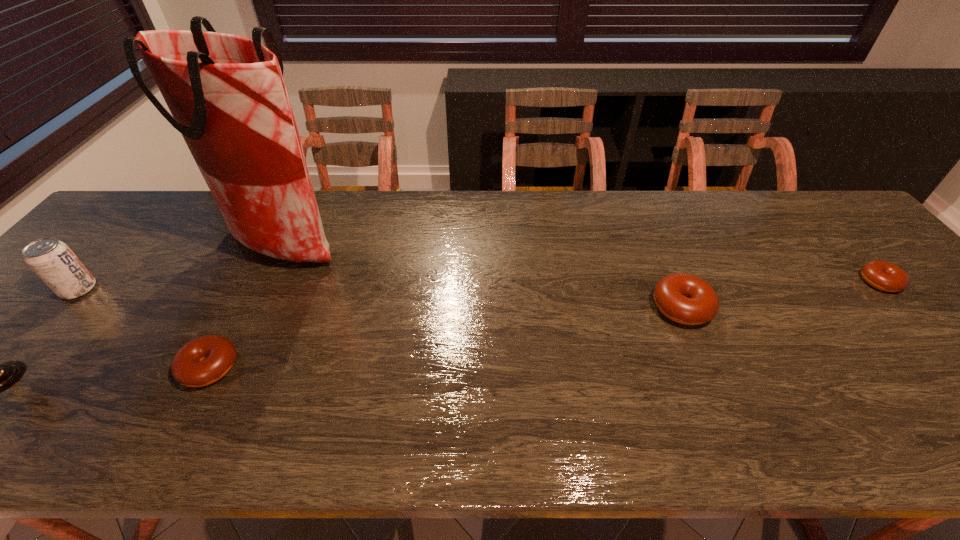
In the image, there is a desktop. Where is `vacant space at the left edge`? The width and height of the screenshot is (960, 540). vacant space at the left edge is located at coordinates (91, 248).

Locate an element on the screen. The image size is (960, 540). free region at the right edge is located at coordinates (858, 287).

In the image, there is a desktop. In order to click on blank space at the near left corner in this screenshot , I will do `click(2, 402)`.

I want to click on free space between the second object from right to left and the nearest doughnut, so click(x=445, y=337).

Locate an element on the screen. The image size is (960, 540). vacant area that lies between the grocery bag and the third shortest object is located at coordinates (483, 278).

At what (x,y) coordinates should I click in order to perform the action: click on vacant point located between the shortest doughnut and the third tallest object. Please return your answer as a coordinate pair (x, y). Looking at the image, I should click on (780, 294).

Find the location of a particular element. The height and width of the screenshot is (540, 960). vacant space that is in between the tallest object and the second doughnut from left to right is located at coordinates (483, 278).

This screenshot has height=540, width=960. In order to click on free space between the nearest doughnut and the soda can in this screenshot , I will do `click(144, 328)`.

Find the location of `empty space between the second shortest object and the third tallest object`. empty space between the second shortest object and the third tallest object is located at coordinates (445, 337).

Select which object appears as the closest to the leftmost object. Please provide its 2D coordinates. Your answer should be formatted as a tuple, i.e. [(x, y)], where the tuple contains the x and y coordinates of a point satisfying the conditions above.

[(226, 93)]